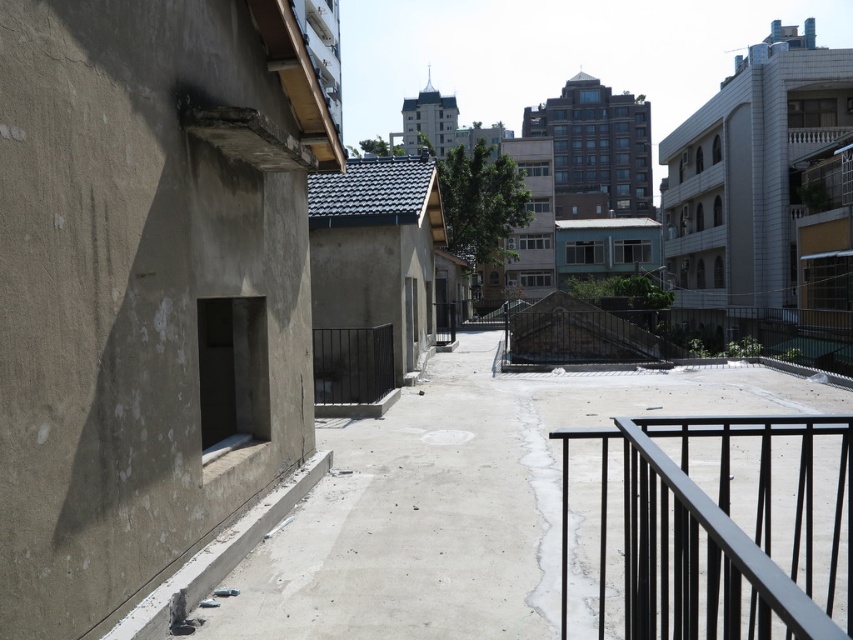
You are a delivery drone that needs to navigate through the area shown in the image. You must fly from the smooth concrete alley at center to the black metal railing at right. Is the alley wide enough for your drone to safely maneuver to the railing without touching it?

The smooth concrete alley at center might be wider than black metal railing at right, so there is a possibility that the alley is wide enough for the drone to maneuver safely. However, since the width comparison is uncertain, caution is advised to avoid collisions.

You are a delivery drone carrying a package and need to land in the smooth concrete alley at center. The black metal railing at right is nearby. Considering the drone requires a minimum of 5 meters of clearance to safely descend, can you safely land in the alley?

The distance between the smooth concrete alley at center and the black metal railing at right is 8.27 meters. Since the drone needs 5 meters of clearance, there is sufficient space to safely land in the alley.

You are standing on the balcony looking down at the courtyard. There are two points marked on the ground, one at coordinates point (399, 566) and the other at point (704, 477). Which point is closer to you?

Point (399, 566) is closer to the viewer than point (704, 477).